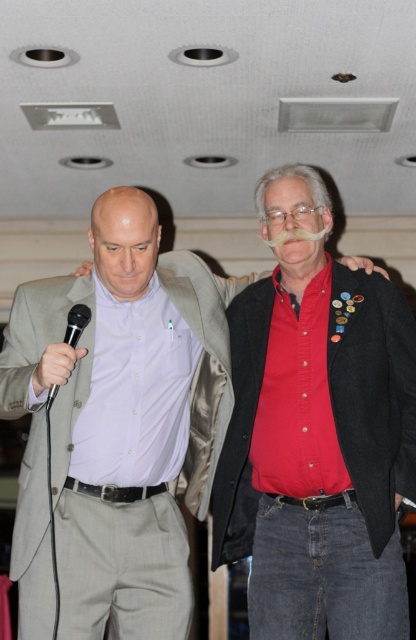
Question: Which point is farther to the camera?

Choices:
 (A) black matte microphone at left
 (B) red button-up shirt at center
 (C) red matte button-up shirt at center

Answer: (C)

Question: Does red button-up shirt at center have a lesser width compared to black matte microphone at left?

Choices:
 (A) yes
 (B) no

Answer: (B)

Question: Is red matte button-up shirt at center bigger than black matte microphone at left?

Choices:
 (A) yes
 (B) no

Answer: (A)

Question: Which object is closer to the camera taking this photo?

Choices:
 (A) black matte microphone at left
 (B) red matte button-up shirt at center
 (C) red button-up shirt at center

Answer: (A)

Question: Where is red button-up shirt at center located in relation to black matte microphone at left in the image?

Choices:
 (A) above
 (B) below

Answer: (B)

Question: Estimate the real-world distances between objects in this image. Which object is farther from the red button-up shirt at center?

Choices:
 (A) red matte button-up shirt at center
 (B) black matte microphone at left

Answer: (B)